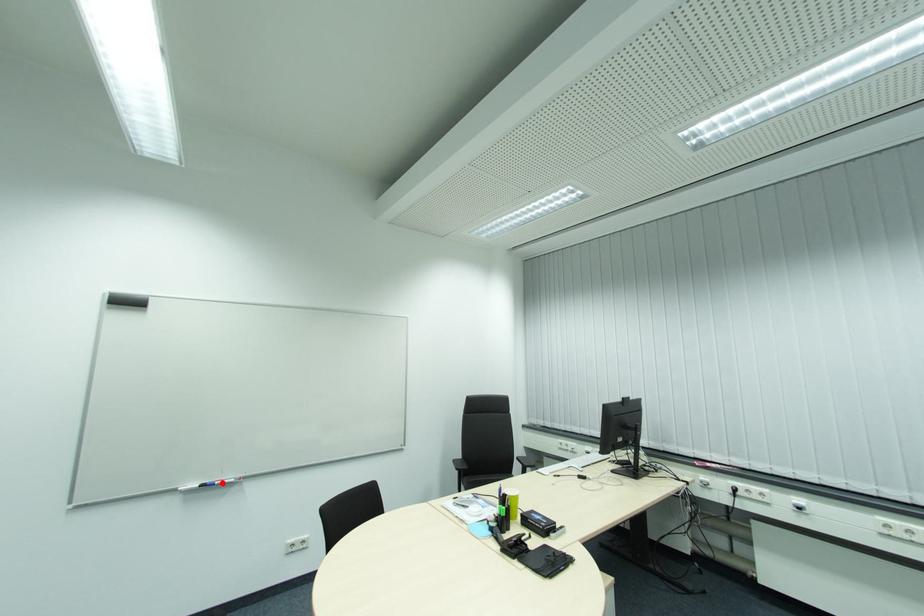
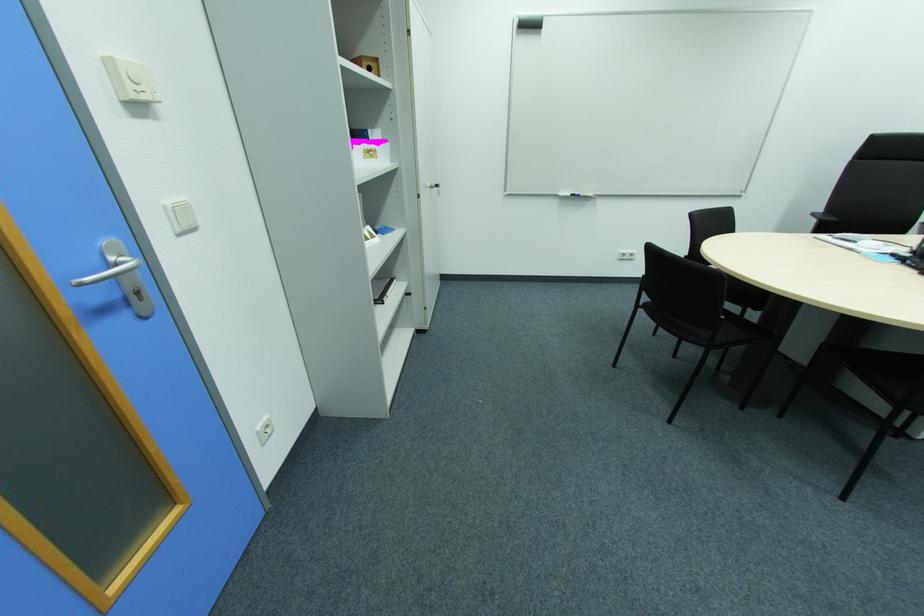
Question: I am providing you with two images of the same scene from different viewpoints. A red point is shown in image1. For the corresponding object point in image2, is it positioned nearer or farther from the camera?

Choices:
 (A) Nearer
 (B) Farther

Answer: (A)